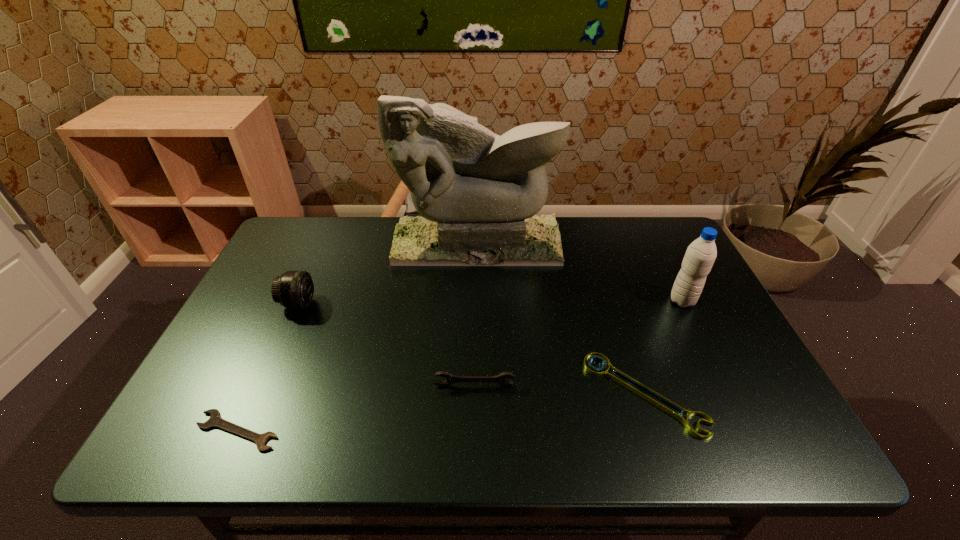
Locate an element on the screen. The image size is (960, 540). the tallest object is located at coordinates (478, 193).

Find the location of a particular element. sculpture is located at coordinates (478, 193).

Find the location of a particular element. The width and height of the screenshot is (960, 540). the rightmost object is located at coordinates (700, 255).

Identify the location of the fifth shortest object. The height and width of the screenshot is (540, 960). (700, 255).

Locate an element on the screen. This screenshot has width=960, height=540. telephoto lens is located at coordinates (293, 289).

You are a GUI agent. You are given a task and a screenshot of the screen. Output one action in this format:
    pyautogui.click(x=<x>, y=<y>)
    Task: Click on the second wrench from right to left
    
    Given the screenshot: What is the action you would take?
    pyautogui.click(x=450, y=379)

Find the location of a particular element. the tallest wrench is located at coordinates (450, 379).

Identify the location of the second shortest object. The height and width of the screenshot is (540, 960). (666, 405).

You are a GUI agent. You are given a task and a screenshot of the screen. Output one action in this format:
    pyautogui.click(x=<x>, y=<y>)
    Task: Click on the second shortest wrench
    The height and width of the screenshot is (540, 960).
    Given the screenshot: What is the action you would take?
    pyautogui.click(x=666, y=405)

In order to click on the shortest wrench in this screenshot , I will do pyautogui.click(x=215, y=420).